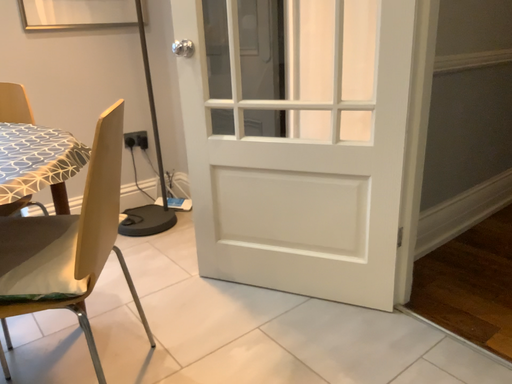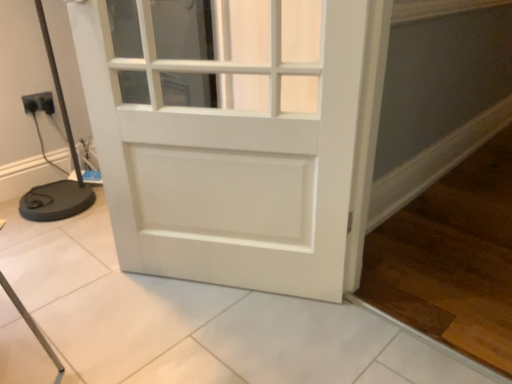
Question: Which way did the camera rotate in the video?

Choices:
 (A) rotated upward
 (B) rotated downward

Answer: (B)